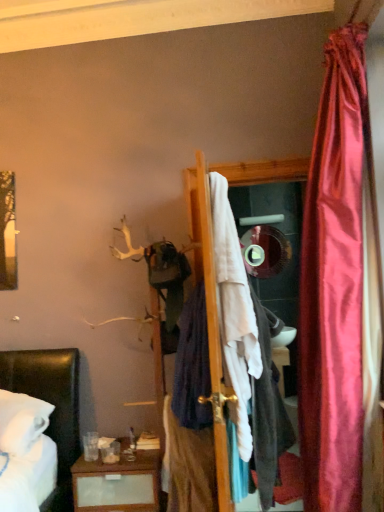
Question: Does white fabric at center, the 3th clothing positioned from the left, have a smaller size compared to dark blue fabric at center, which is the second clothing from left to right?

Choices:
 (A) no
 (B) yes

Answer: (A)

Question: Is white fabric at center, the 3th clothing positioned from the left, at the left side of dark blue fabric at center, the 2th clothing positioned from the right?

Choices:
 (A) no
 (B) yes

Answer: (A)

Question: Can you confirm if white fabric at center, the 3th clothing positioned from the left, is thinner than dark blue fabric at center, which is the second clothing from left to right?

Choices:
 (A) no
 (B) yes

Answer: (A)

Question: Is white fabric at center, the 3th clothing positioned from the left, with dark blue fabric at center, which is the second clothing from left to right?

Choices:
 (A) no
 (B) yes

Answer: (A)

Question: From the image's perspective, does white fabric at center, the 3th clothing positioned from the left, appear higher than dark blue fabric at center, which is the second clothing from left to right?

Choices:
 (A) no
 (B) yes

Answer: (A)

Question: Is white fabric at center, marked as the 1th clothing in a right-to-left arrangement, bigger than dark blue fabric at center, which is the second clothing from left to right?

Choices:
 (A) no
 (B) yes

Answer: (B)

Question: Can we say shiny silver mirror at center lies outside dark blue fabric at center, the 2th clothing positioned from the right?

Choices:
 (A) no
 (B) yes

Answer: (B)

Question: Can dark blue fabric at center, which is the second clothing from left to right, be found inside shiny silver mirror at center?

Choices:
 (A) no
 (B) yes

Answer: (A)

Question: Is dark blue fabric at center, which is the second clothing from left to right, at the back of shiny silver mirror at center?

Choices:
 (A) yes
 (B) no

Answer: (B)

Question: Could you tell me if shiny silver mirror at center is facing dark blue fabric at center, the 2th clothing positioned from the right?

Choices:
 (A) no
 (B) yes

Answer: (B)

Question: Is shiny silver mirror at center smaller than dark blue fabric at center, the 2th clothing positioned from the right?

Choices:
 (A) no
 (B) yes

Answer: (B)

Question: Does shiny silver mirror at center have a larger size compared to dark blue fabric at center, which is the second clothing from left to right?

Choices:
 (A) yes
 (B) no

Answer: (B)

Question: Does dark blue fabric at center, which appears as the third clothing when viewed from the right, appear on the right side of white fabric at center, marked as the 1th clothing in a right-to-left arrangement?

Choices:
 (A) no
 (B) yes

Answer: (A)